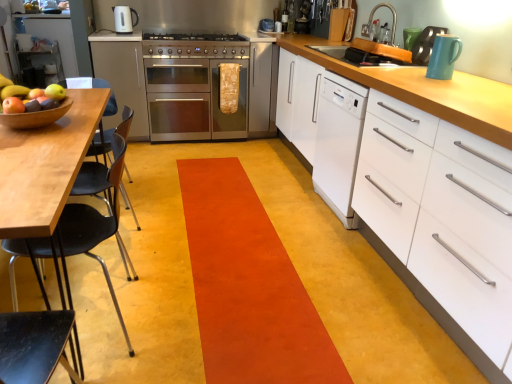
Find the location of `free space on the front side of matte brown apple at left`. free space on the front side of matte brown apple at left is located at coordinates (23, 99).